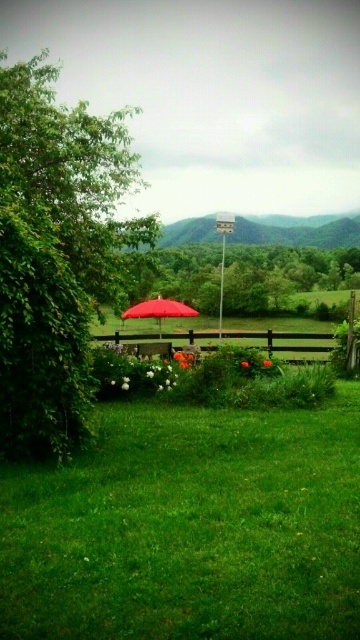
Question: Among these objects, which one is nearest to the camera?

Choices:
 (A) green leafy tree at left
 (B) green leafy tree at center

Answer: (A)

Question: Estimate the real-world distances between objects in this image. Which object is farther from the matte red umbrella at center?

Choices:
 (A) green leafy tree at center
 (B) green leafy tree at left

Answer: (B)

Question: Can you confirm if green leafy tree at center is positioned below matte red umbrella at center?

Choices:
 (A) yes
 (B) no

Answer: (B)

Question: Which point is farther to the camera?

Choices:
 (A) (195, 244)
 (B) (174, 308)
 (C) (86, 193)

Answer: (A)

Question: Does green leafy tree at left lie behind green leafy tree at center?

Choices:
 (A) yes
 (B) no

Answer: (B)

Question: Does green leafy tree at left have a greater width compared to matte red umbrella at center?

Choices:
 (A) no
 (B) yes

Answer: (B)